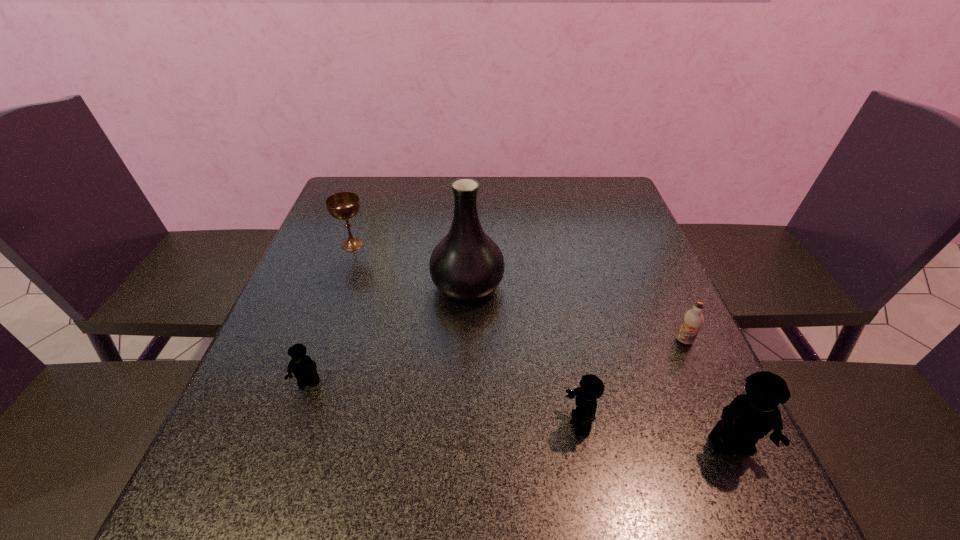
Find the location of a particular element. The height and width of the screenshot is (540, 960). object present at the near right corner is located at coordinates (750, 416).

In the image, there is a desktop. Where is `vacant space at the far edge`? vacant space at the far edge is located at coordinates (574, 208).

This screenshot has width=960, height=540. I want to click on vacant space at the near edge of the desktop, so click(x=487, y=439).

Where is `vacant area at the left edge of the desktop`? The image size is (960, 540). vacant area at the left edge of the desktop is located at coordinates (331, 255).

Where is `vacant point at the right edge`? This screenshot has width=960, height=540. vacant point at the right edge is located at coordinates (591, 227).

In the image, there is a desktop. At what (x,y) coordinates should I click in order to perform the action: click on vacant space at the far left corner. Please return your answer as a coordinate pair (x, y). Looking at the image, I should click on (357, 188).

This screenshot has width=960, height=540. Find the location of `vacant space at the near left corner of the desktop`. vacant space at the near left corner of the desktop is located at coordinates pyautogui.click(x=280, y=411).

Where is `blank space at the far right corner of the desktop`? blank space at the far right corner of the desktop is located at coordinates (583, 207).

In order to click on free space between the fourth object from left to right and the chocolate milk in this screenshot , I will do `click(632, 382)`.

The width and height of the screenshot is (960, 540). I want to click on free space between the second Lego from left to right and the second farthest object, so click(523, 354).